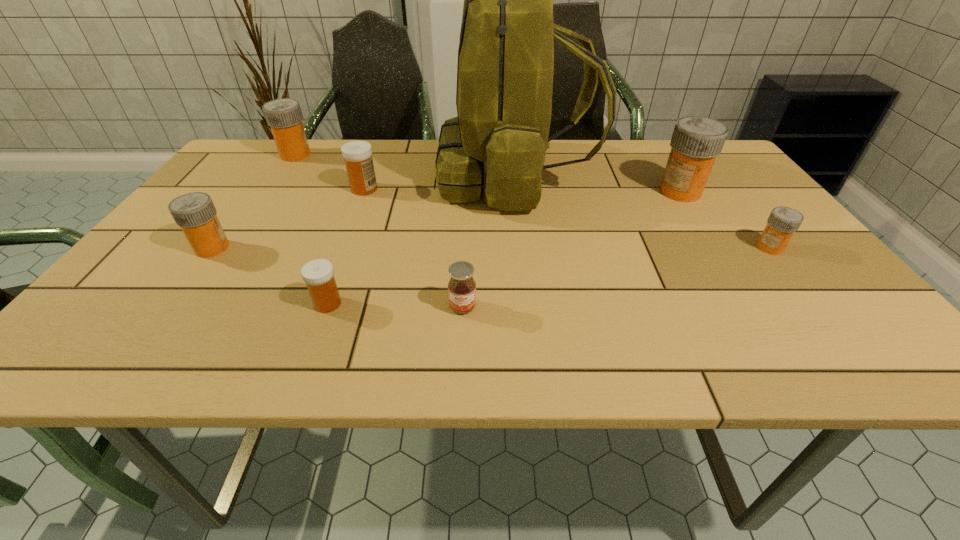
The width and height of the screenshot is (960, 540). I want to click on free space that satisfies the following two spatial constraints: 1. on the label side of the smaller white medicine; 2. on the left side of the third smallest orange medicine, so click(x=196, y=303).

The width and height of the screenshot is (960, 540). In order to click on vacant space that satisfies the following two spatial constraints: 1. on the label side of the third nearest orange medicine; 2. on the label side of the jam in this screenshot , I will do `click(754, 307)`.

Image resolution: width=960 pixels, height=540 pixels. I want to click on free space that satisfies the following two spatial constraints: 1. on the front-facing side of the backpack; 2. on the front side of the farther white medicine, so click(x=516, y=189).

What are the coordinates of `free spot that satisfies the following two spatial constraints: 1. on the label side of the nearer white medicine; 2. on the left side of the farthest orange medicine` in the screenshot? It's located at (196, 303).